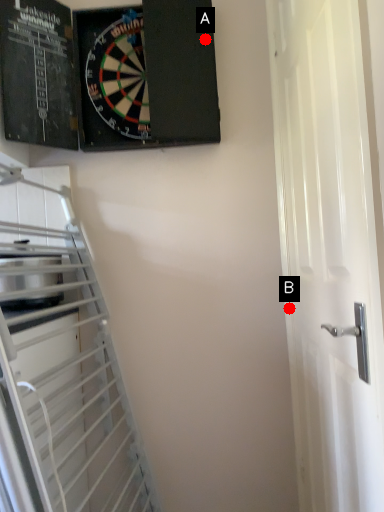
Question: Two points are circled on the image, labeled by A and B beside each circle. Which point is farther to the camera?

Choices:
 (A) A is further
 (B) B is further

Answer: (B)